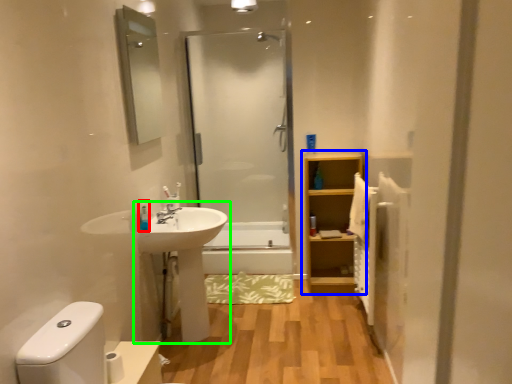
Question: Which object is positioned closest to toiletry (highlighted by a red box)? Select from bathroom cabinet (highlighted by a blue box) and sink (highlighted by a green box).

Choices:
 (A) bathroom cabinet
 (B) sink

Answer: (B)